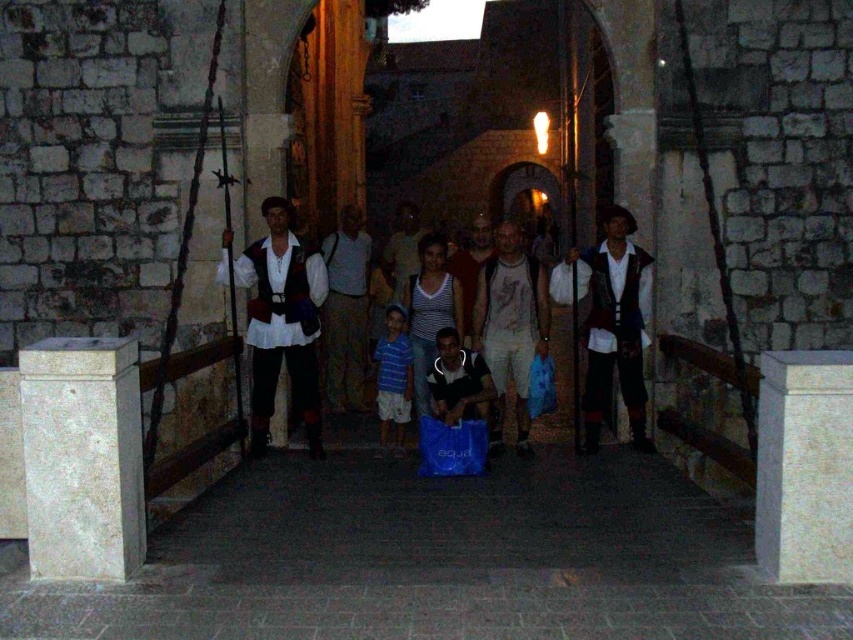
Question: Is striped cotton shirt at center to the left of blue plastic bag at center from the viewer's perspective?

Choices:
 (A) no
 (B) yes

Answer: (B)

Question: Among these objects, which one is nearest to the camera?

Choices:
 (A) white cotton shirt at center
 (B) matte white shirt at center
 (C) matte red vest at center

Answer: (C)

Question: Is white marble pillar at center positioned at the back of white cotton shirt at center?

Choices:
 (A) yes
 (B) no

Answer: (B)

Question: Which is farther from the matte red vest at center?

Choices:
 (A) beige marble pillar at lower left
 (B) white cotton t-shirt at center

Answer: (A)

Question: Among these points, which one is farthest from the camera?

Choices:
 (A) (445, 474)
 (B) (496, 243)
 (C) (474, 280)
 (D) (397, 227)

Answer: (D)

Question: Does white cotton shirt at center have a smaller size compared to matte red vest at center?

Choices:
 (A) no
 (B) yes

Answer: (B)